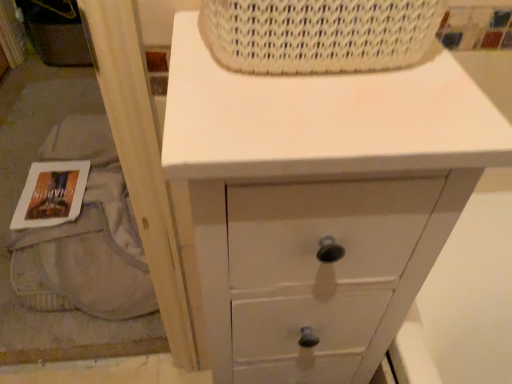
Question: Looking at their shapes, would you say white painted wood chest of drawers at upper center is wider or thinner than white paper book at lower left?

Choices:
 (A) wide
 (B) thin

Answer: (A)

Question: Looking at the image, does white painted wood chest of drawers at upper center seem bigger or smaller compared to white paper book at lower left?

Choices:
 (A) big
 (B) small

Answer: (A)

Question: Considering the real-world distances, which object is farthest from the white painted wood chest of drawers at upper center?

Choices:
 (A) white paper book at lower left
 (B) white woven basket at upper center

Answer: (A)

Question: Which is farther from the white woven basket at upper center?

Choices:
 (A) white painted wood chest of drawers at upper center
 (B) white paper book at lower left

Answer: (B)